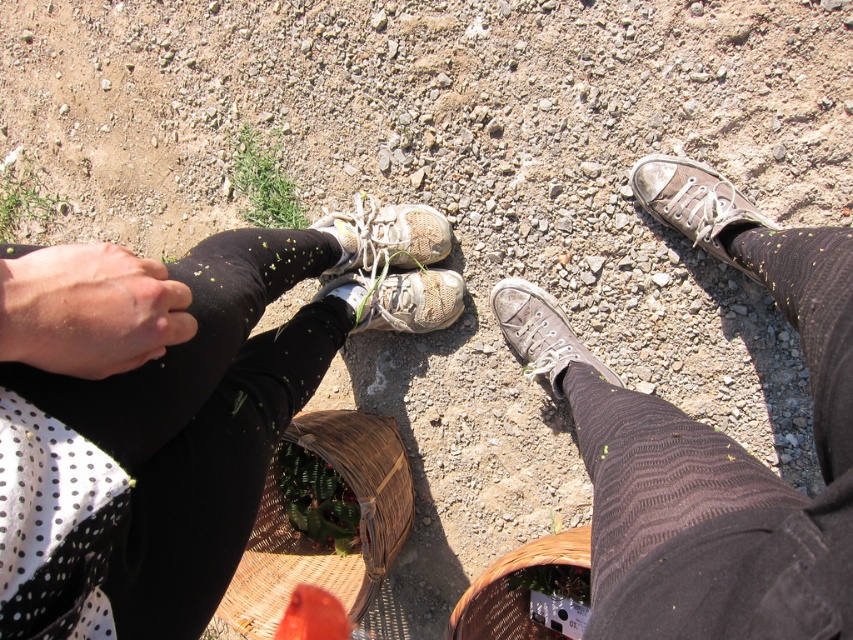
Consider the image. Does brown canvas sneaker at right have a smaller size compared to white mesh shoe at center?

Incorrect, brown canvas sneaker at right is not smaller in size than white mesh shoe at center.

Which is in front, point (677, 170) or point (402, 305)?

Point (677, 170)

You are a GUI agent. You are given a task and a screenshot of the screen. Output one action in this format:
    pyautogui.click(x=<x>, y=<y>)
    Task: Click on the brown canvas sneaker at right
    The width and height of the screenshot is (853, 640).
    Given the screenshot: What is the action you would take?
    pyautogui.click(x=693, y=202)

Is woven brown basket at lower center taller than matte gray sneaker at center?

Yes, woven brown basket at lower center is taller than matte gray sneaker at center.

Who is more distant from viewer, (473, 628) or (508, 285)?

The point (508, 285) is more distant.

This screenshot has height=640, width=853. In order to click on woven brown basket at lower center in this screenshot , I will do `click(515, 589)`.

Which of these two, brown canvas shoe at center or brown woven basket at center, stands taller?

Standing taller between the two is brown canvas shoe at center.

Does point (717, 604) come closer to viewer compared to point (366, 481)?

Yes.

At what (x,y) coordinates should I click in order to perform the action: click on brown canvas shoe at center. Please return your answer as a coordinate pair (x, y). The height and width of the screenshot is (640, 853). Looking at the image, I should click on (709, 444).